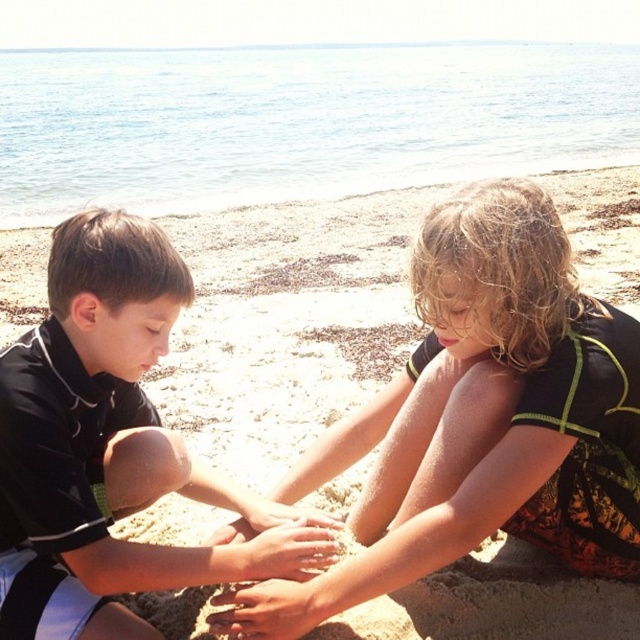
Question: Which object appears closest to the camera in this image?

Choices:
 (A) smooth sand hands at center
 (B) black matte shirt at center

Answer: (B)

Question: Does dark brown curly hair at center have a smaller size compared to black matte shirt at center?

Choices:
 (A) no
 (B) yes

Answer: (A)

Question: In this image, where is dark brown curly hair at center located relative to smooth sand hands at center?

Choices:
 (A) right
 (B) left

Answer: (A)

Question: Which object is positioned closest to the smooth sand hands at center?

Choices:
 (A) dark brown curly hair at center
 (B) black matte shirt at center

Answer: (B)

Question: Which point is farther to the camera?

Choices:
 (A) smooth sand hands at center
 (B) black matte shirt at center
 (C) dark brown curly hair at center

Answer: (A)

Question: In this image, where is black matte shirt at center located relative to smooth sand hands at center?

Choices:
 (A) right
 (B) left

Answer: (B)